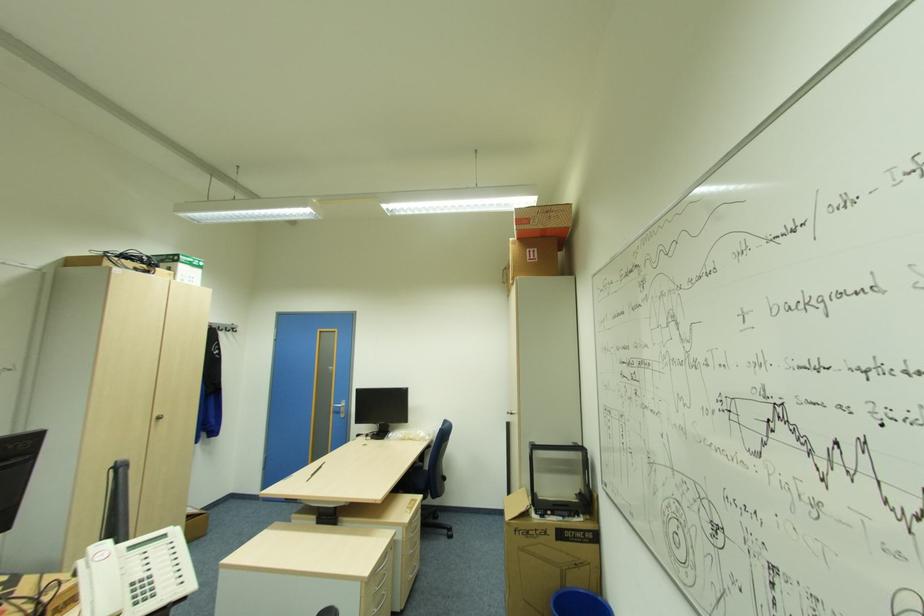
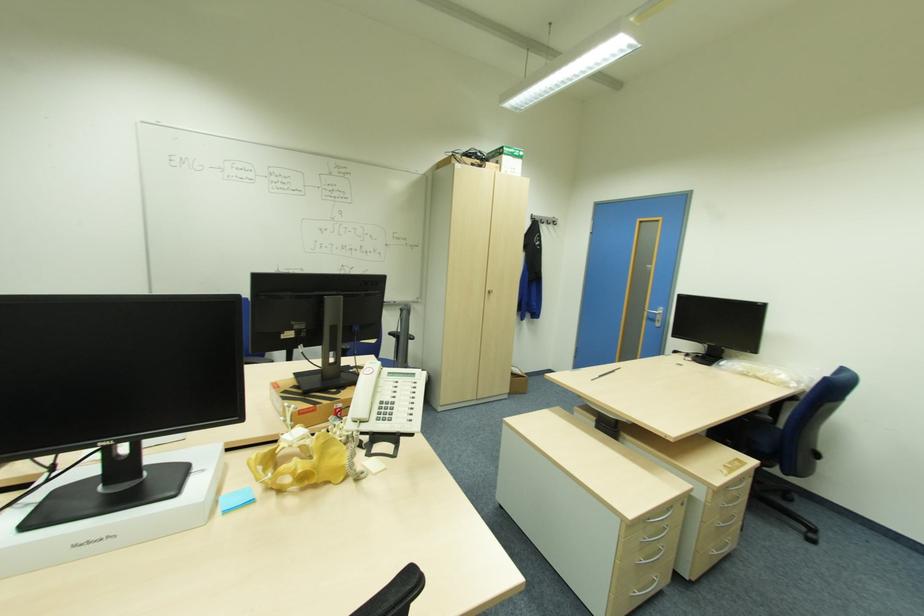
In the second image, find the point that corresponds to pixel 345 411 in the first image.

(661, 321)